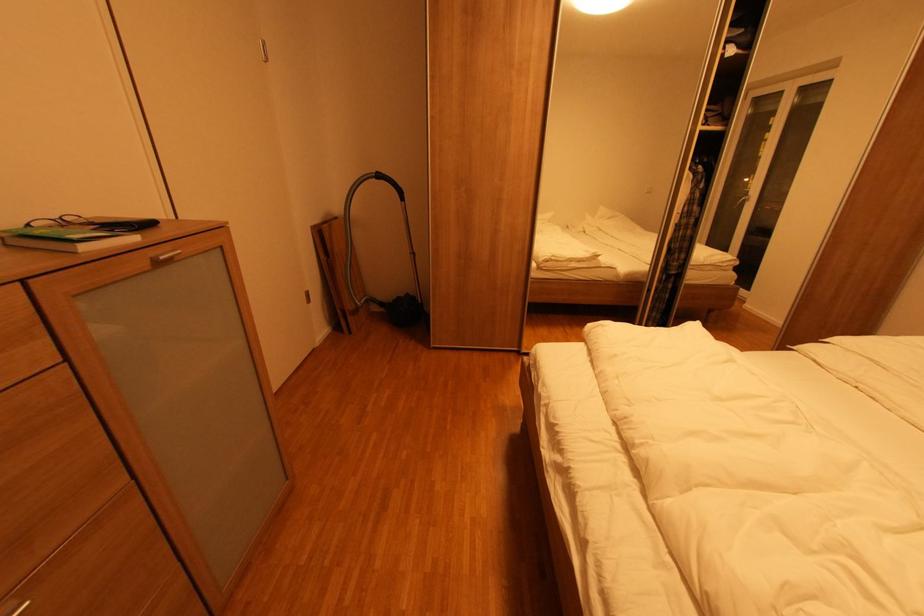
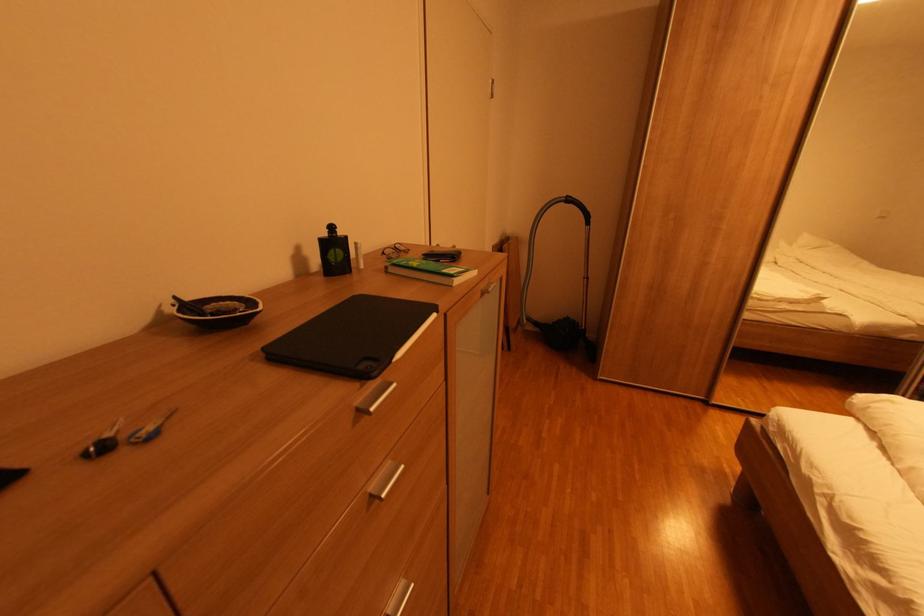
Question: How did the camera likely rotate?

Choices:
 (A) Left
 (B) Right
 (C) Up
 (D) Down

Answer: (A)